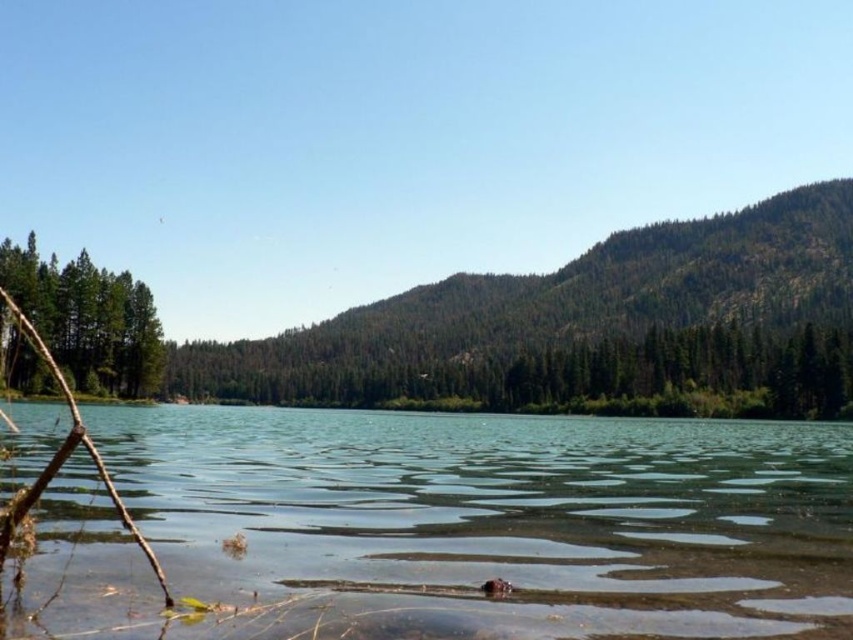
You are standing at the edge of the clear water at center and want to walk towards the green forested mountain at center. Which direction should you head?

You should head to the right because the clear water at center is to the left of green forested mountain at center, so moving right would take you towards the mountain.

You are a hiker standing at the edge of the clear water at center and looking towards the green forested mountain at center. Which object appears closer to you based on their height in the image?

The clear water at center appears closer to you because it is shorter than the green forested mountain at center, which is taller and thus appears farther away.

You are standing at the edge of the water and want to walk to the green matte tree at left. Which direction should you head to reach it first without crossing the clear water at center?

The green matte tree at left is further away from you than the clear water at center. To reach the green matte tree at left first without crossing the clear water at center, you should head towards the left side where the tree is located, but since the water is closer, you might need to go around it. However, based on the description, the clear water at center is closer, so the tree is behind it. Therefore, you cannot reach the tree without passing the water.